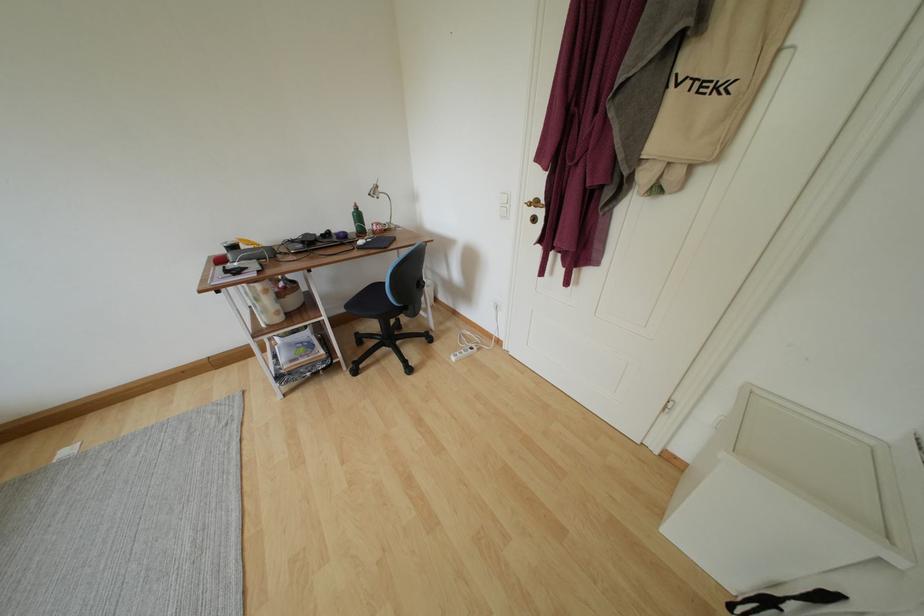
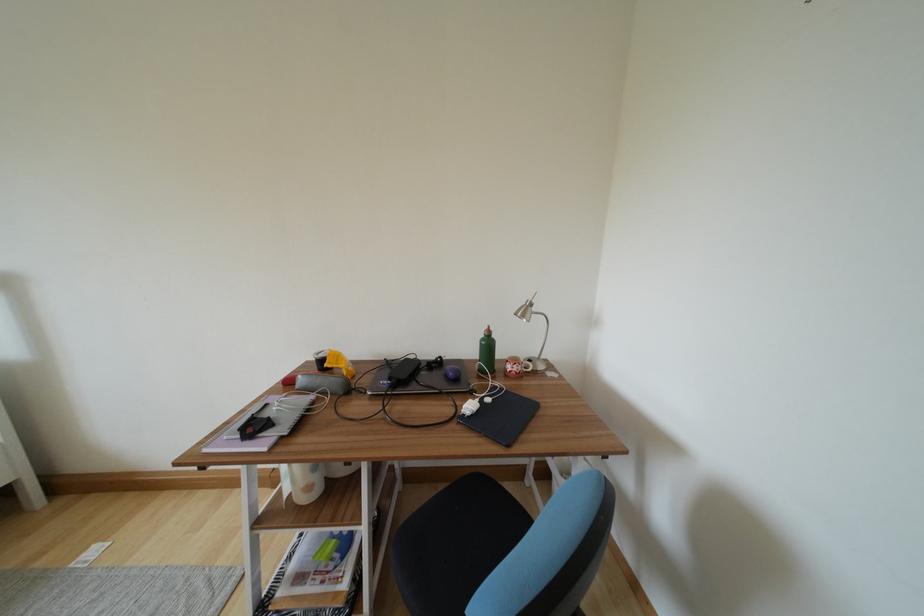
The point at (380, 232) is marked in the first image. Where is the corresponding point in the second image?

(514, 371)